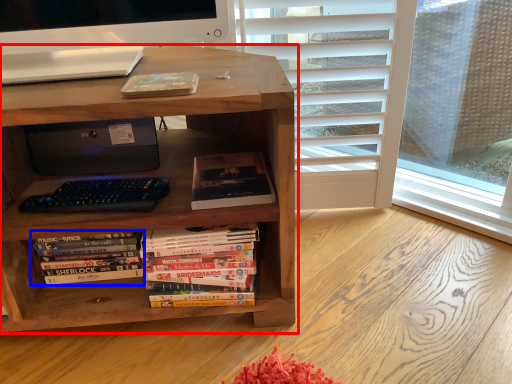
Question: Which point is further to the camera, bookcase (highlighted by a red box) or book (highlighted by a blue box)?

Choices:
 (A) bookcase
 (B) book

Answer: (B)